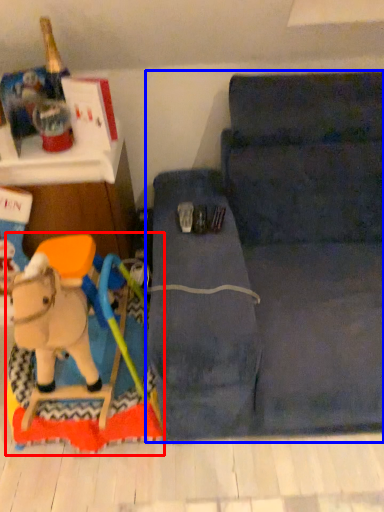
Question: Which point is further to the camera, toy (highlighted by a red box) or studio couch (highlighted by a blue box)?

Choices:
 (A) toy
 (B) studio couch

Answer: (A)